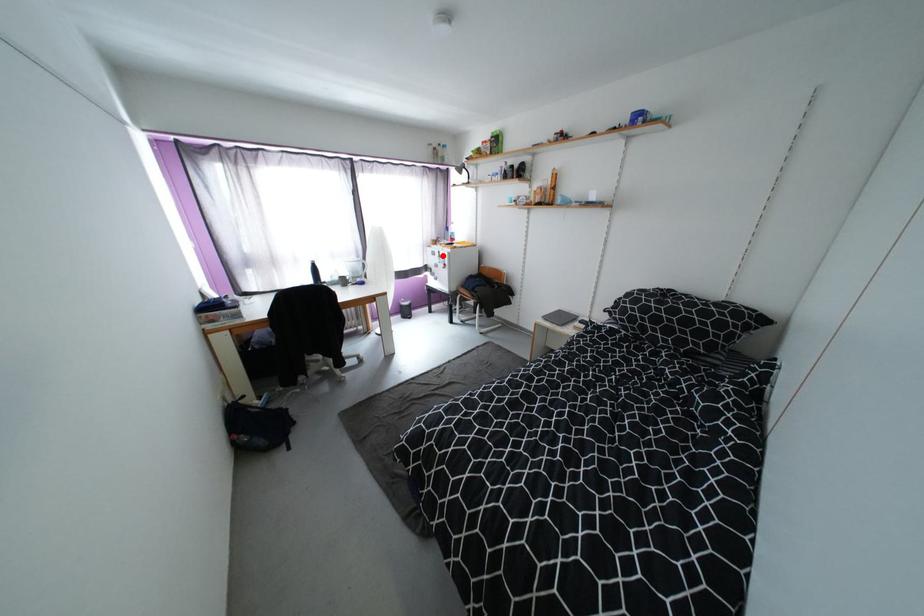
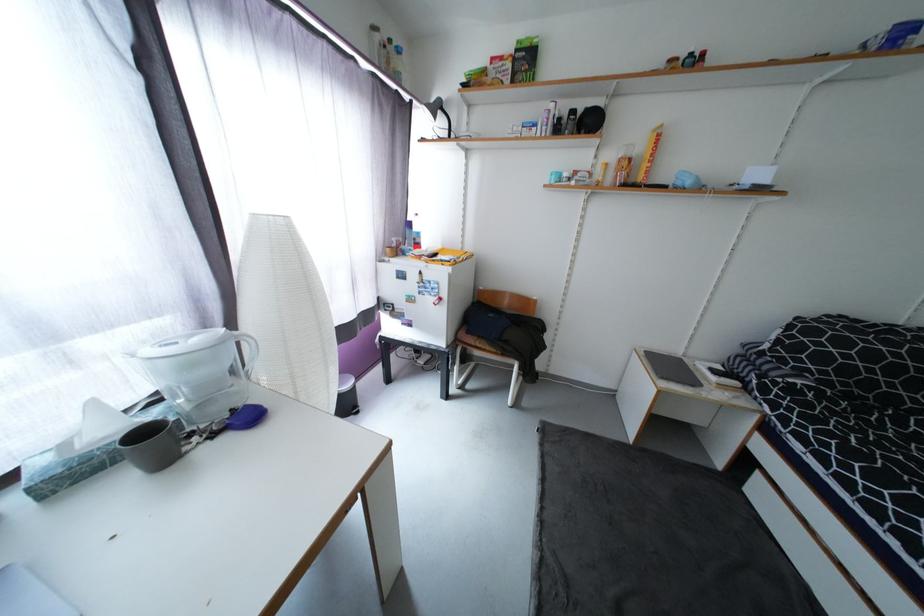
In the second image, find the point that corresponds to the highlighted location in the first image.

(419, 278)